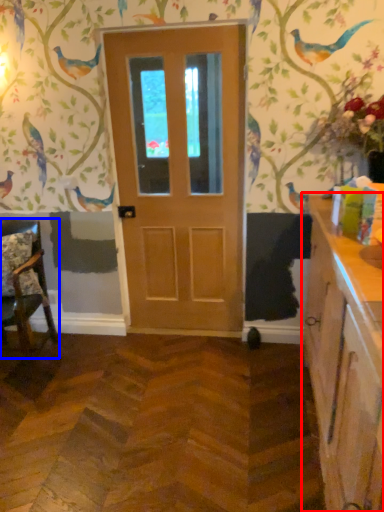
Question: Among these objects, which one is farthest to the camera, cabinetry (highlighted by a red box) or chair (highlighted by a blue box)?

Choices:
 (A) cabinetry
 (B) chair

Answer: (B)